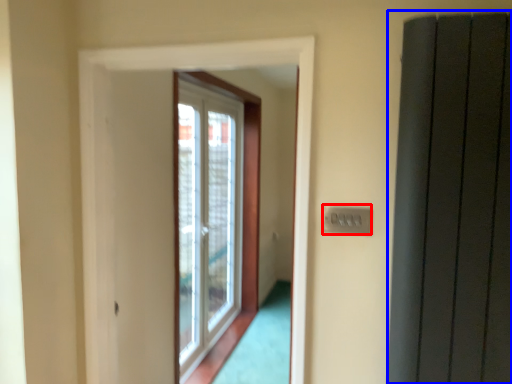
Question: Which object is closer to the camera taking this photo, electric outlet (highlighted by a red box) or elevator (highlighted by a blue box)?

Choices:
 (A) electric outlet
 (B) elevator

Answer: (B)